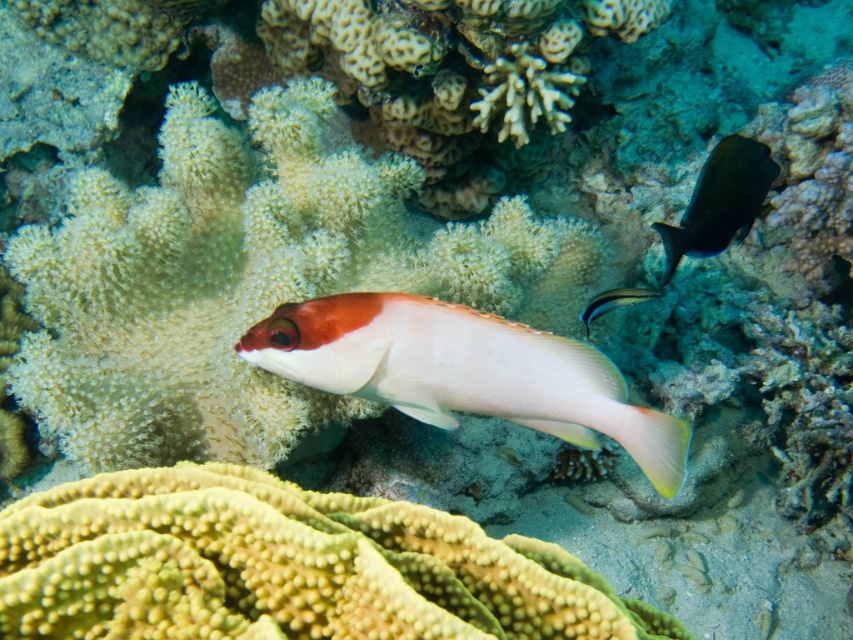
Looking at this image, can you confirm if matte white clownfish at center is positioned to the left of shiny black fish at upper right?

Yes, matte white clownfish at center is to the left of shiny black fish at upper right.

Who is lower down, matte white clownfish at center or shiny black fish at upper right?

matte white clownfish at center is below.

Between point (421, 408) and point (677, 236), which one is positioned behind?

Positioned behind is point (677, 236).

Image resolution: width=853 pixels, height=640 pixels. Identify the location of matte white clownfish at center. (463, 371).

Who is higher up, shiny black fish at upper right or shiny silver fish at center?

shiny black fish at upper right is above.

Is shiny black fish at upper right bigger than shiny silver fish at center?

Correct, shiny black fish at upper right is larger in size than shiny silver fish at center.

This screenshot has width=853, height=640. What do you see at coordinates (720, 200) in the screenshot?
I see `shiny black fish at upper right` at bounding box center [720, 200].

Locate an element on the screen. shiny black fish at upper right is located at coordinates (720, 200).

Who is higher up, matte white clownfish at center or shiny silver fish at center?

Positioned higher is shiny silver fish at center.

Which is behind, point (329, 330) or point (613, 292)?

Point (613, 292)

Is point (462, 410) farther from viewer compared to point (631, 300)?

No, (462, 410) is in front of (631, 300).

You are a GUI agent. You are given a task and a screenshot of the screen. Output one action in this format:
    pyautogui.click(x=<x>, y=<y>)
    Task: Click on the matte white clownfish at center
    
    Given the screenshot: What is the action you would take?
    pyautogui.click(x=463, y=371)